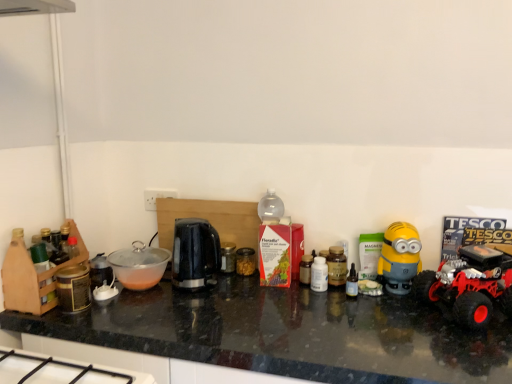
Where is `vacant area that is in front of black plastic kettle at center`? The width and height of the screenshot is (512, 384). vacant area that is in front of black plastic kettle at center is located at coordinates (182, 310).